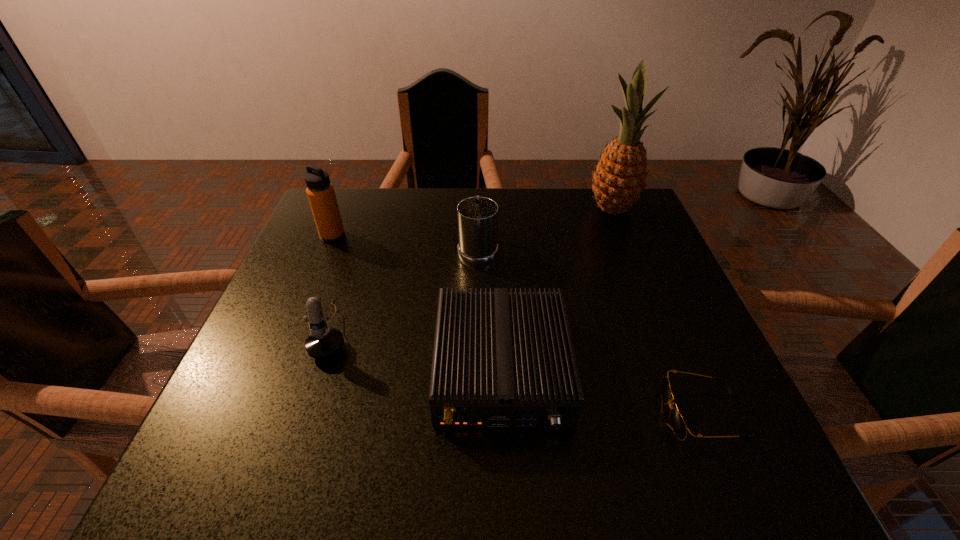
Identify the location of free space at the near edge of the desktop. point(466,469).

In order to click on vacant position at the left edge of the desktop in this screenshot , I will do `click(269, 371)`.

You are a GUI agent. You are given a task and a screenshot of the screen. Output one action in this format:
    pyautogui.click(x=<x>, y=<y>)
    Task: Click on the vacant space at the right edge
    The image size is (960, 540).
    Given the screenshot: What is the action you would take?
    pyautogui.click(x=724, y=399)

In the image, there is a desktop. Where is `vacant space at the far left corner`? This screenshot has width=960, height=540. vacant space at the far left corner is located at coordinates (360, 205).

Find the location of a particular element. The height and width of the screenshot is (540, 960). free spot at the near left corner of the desktop is located at coordinates (216, 449).

This screenshot has width=960, height=540. Identify the location of vacant region at the far right corner of the desktop. (596, 220).

I want to click on unoccupied position between the pineapple and the second shortest object, so click(x=557, y=289).

Locate an element on the screen. free spot between the mug and the microphone is located at coordinates (406, 289).

Where is `vacant area between the fifth tallest object and the sunglasses`? This screenshot has height=540, width=960. vacant area between the fifth tallest object and the sunglasses is located at coordinates (602, 392).

Locate an element on the screen. The width and height of the screenshot is (960, 540). blank region between the sunglasses and the second shortest object is located at coordinates (602, 392).